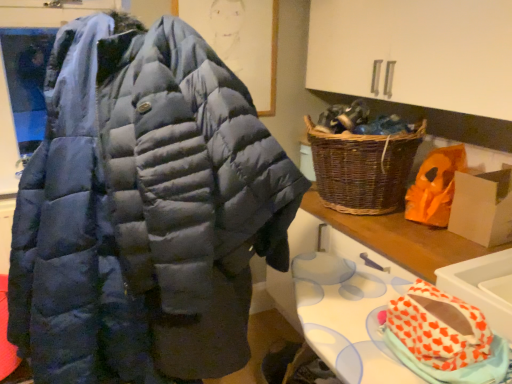
What is the approximate height of white cardboard box at right?

The height of white cardboard box at right is 10.53 inches.

This screenshot has width=512, height=384. Describe the element at coordinates (483, 207) in the screenshot. I see `white cardboard box at right` at that location.

Image resolution: width=512 pixels, height=384 pixels. Find the location of `navy blue puffer jacket at center`. navy blue puffer jacket at center is located at coordinates (149, 220).

Where is `woven brown picnic basket at right`? woven brown picnic basket at right is located at coordinates (362, 168).

Identify the location of white cardboard box at right. (483, 207).

Can we say navy blue puffer jacket at center lies outside orange paper bag at right?

Absolutely, navy blue puffer jacket at center is external to orange paper bag at right.

Who is taller, navy blue puffer jacket at center or orange paper bag at right?

navy blue puffer jacket at center is taller.

Between navy blue puffer jacket at center and orange paper bag at right, which one has larger width?

With larger width is navy blue puffer jacket at center.

From a real-world perspective, is navy blue puffer jacket at center below orange paper bag at right?

Correct, in the physical world, navy blue puffer jacket at center is lower than orange paper bag at right.

From the picture: Is white cardboard box at right not within white glossy sink at lower right?

Indeed, white cardboard box at right is completely outside white glossy sink at lower right.

From a real-world perspective, which is physically below, white cardboard box at right or white glossy sink at lower right?

white glossy sink at lower right.

Considering the positions of points (469, 228) and (509, 270), is point (469, 228) farther from camera compared to point (509, 270)?

Yes, point (469, 228) is behind point (509, 270).

Can you confirm if orange heart-patterned fabric at lower right is thinner than orange paper bag at right?

Yes.

Is orange heart-patterned fabric at lower right facing away from orange paper bag at right?

No, orange heart-patterned fabric at lower right is not facing away from orange paper bag at right.

Which is behind, orange heart-patterned fabric at lower right or orange paper bag at right?

Positioned behind is orange paper bag at right.

Identify the location of stuff that is behind the orange heart-patterned fabric at lower right. The width and height of the screenshot is (512, 384). (435, 186).

Is navy blue puffer jacket at center closer to the viewer compared to white glossy sink at lower right?

Yes.

Can you confirm if navy blue puffer jacket at center is wider than white glossy sink at lower right?

Correct, the width of navy blue puffer jacket at center exceeds that of white glossy sink at lower right.

Is navy blue puffer jacket at center situated inside white glossy sink at lower right or outside?

The correct answer is: outside.

From the image's perspective, is woven brown picnic basket at right located above navy blue puffer jacket at center?

Correct, woven brown picnic basket at right appears higher than navy blue puffer jacket at center in the image.

Which object is more forward, woven brown picnic basket at right or navy blue puffer jacket at center?

navy blue puffer jacket at center.

Based on the photo, does woven brown picnic basket at right have a larger size compared to navy blue puffer jacket at center?

No.

Could you tell me if woven brown picnic basket at right is facing navy blue puffer jacket at center?

Yes, woven brown picnic basket at right faces towards navy blue puffer jacket at center.

Is woven brown picnic basket at right not close to white glossy sink at lower right?

No, woven brown picnic basket at right is in close proximity to white glossy sink at lower right.

From a real-world perspective, is woven brown picnic basket at right physically above white glossy sink at lower right?

Yes, from a real-world perspective, woven brown picnic basket at right is over white glossy sink at lower right

How different are the orientations of woven brown picnic basket at right and white glossy sink at lower right in degrees?

They differ by 4.38 degrees in their facing directions.

Looking at this image, is woven brown picnic basket at right inside or outside of white glossy sink at lower right?

woven brown picnic basket at right exists outside the volume of white glossy sink at lower right.

Is orange paper bag at right inside the boundaries of white cardboard box at right, or outside?

orange paper bag at right cannot be found inside white cardboard box at right.

Is orange paper bag at right aimed at white cardboard box at right?

No, orange paper bag at right does not turn towards white cardboard box at right.

In terms of width, does orange paper bag at right look wider or thinner when compared to white cardboard box at right?

Clearly, orange paper bag at right has less width compared to white cardboard box at right.

Find the location of a particular element. jacket on the left of the orange paper bag at right is located at coordinates coord(149,220).

This screenshot has width=512, height=384. I want to click on sink in front of the white cardboard box at right, so pos(483,287).

Considering their positions, is woven brown picnic basket at right positioned further to orange heart-patterned fabric at lower right than white glossy sink at lower right?

Based on the image, woven brown picnic basket at right appears to be further to orange heart-patterned fabric at lower right.

Which object lies further to the anchor point orange paper bag at right, white glossy sink at lower right or white cardboard box at right?

Among the two, white glossy sink at lower right is located further to orange paper bag at right.

Considering their positions, is orange paper bag at right positioned further to woven brown picnic basket at right than navy blue puffer jacket at center?

navy blue puffer jacket at center lies further to woven brown picnic basket at right than the other object.

Estimate the real-world distances between objects in this image. Which object is further from white glossy sink at lower right, orange heart-patterned fabric at lower right or woven brown picnic basket at right?

woven brown picnic basket at right is positioned further to the anchor white glossy sink at lower right.

When comparing their distances from navy blue puffer jacket at center, does orange heart-patterned fabric at lower right or white glossy sink at lower right seem closer?

orange heart-patterned fabric at lower right.

From the image, which object appears to be farther from woven brown picnic basket at right, white cardboard box at right or navy blue puffer jacket at center?

navy blue puffer jacket at center lies further to woven brown picnic basket at right than the other object.

Which object lies nearer to the anchor point white glossy sink at lower right, orange paper bag at right or white cardboard box at right?

The object closer to white glossy sink at lower right is white cardboard box at right.

From the image, which object appears to be farther from orange paper bag at right, white glossy sink at lower right or navy blue puffer jacket at center?

Among the two, navy blue puffer jacket at center is located further to orange paper bag at right.

Locate an element on the screen. stuff between navy blue puffer jacket at center and white cardboard box at right is located at coordinates (435, 186).

Where is `material between navy blue puffer jacket at center and white glossy sink at lower right from left to right`? The width and height of the screenshot is (512, 384). material between navy blue puffer jacket at center and white glossy sink at lower right from left to right is located at coordinates (439, 328).

Where is `material between navy blue puffer jacket at center and orange paper bag at right from left to right`? Image resolution: width=512 pixels, height=384 pixels. material between navy blue puffer jacket at center and orange paper bag at right from left to right is located at coordinates (439, 328).

The image size is (512, 384). Identify the location of picnic basket located between white glossy sink at lower right and orange paper bag at right in the depth direction. 362,168.